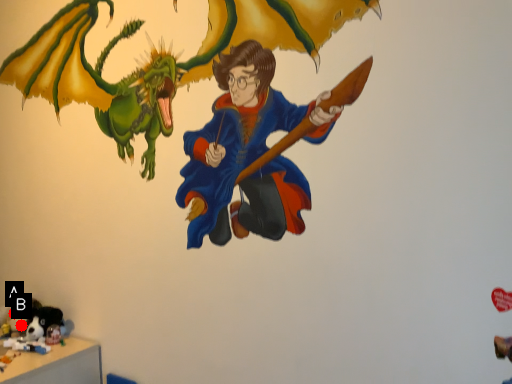
Question: Two points are circled on the image, labeled by A and B beside each circle. Among these points, which one is farthest from the camera?

Choices:
 (A) A is further
 (B) B is further

Answer: (A)